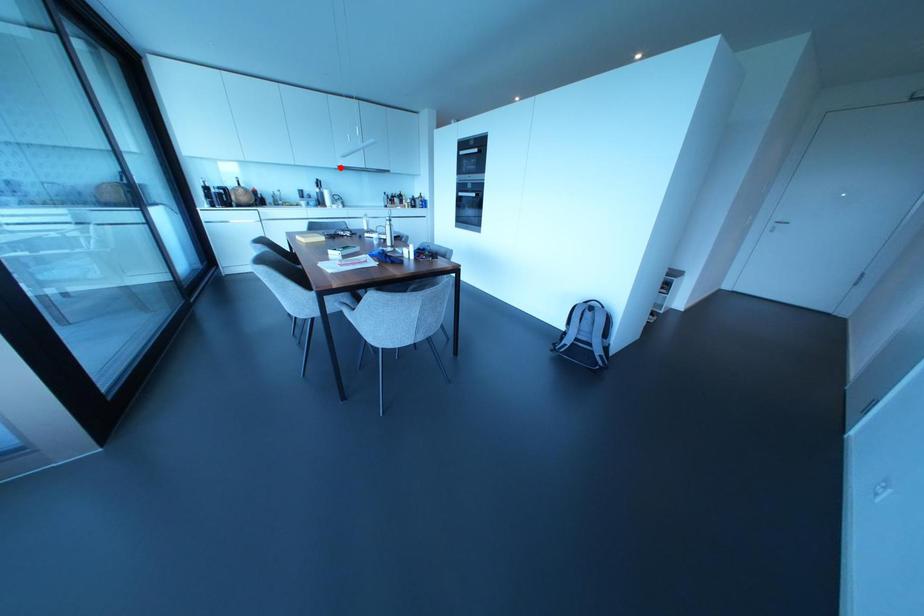
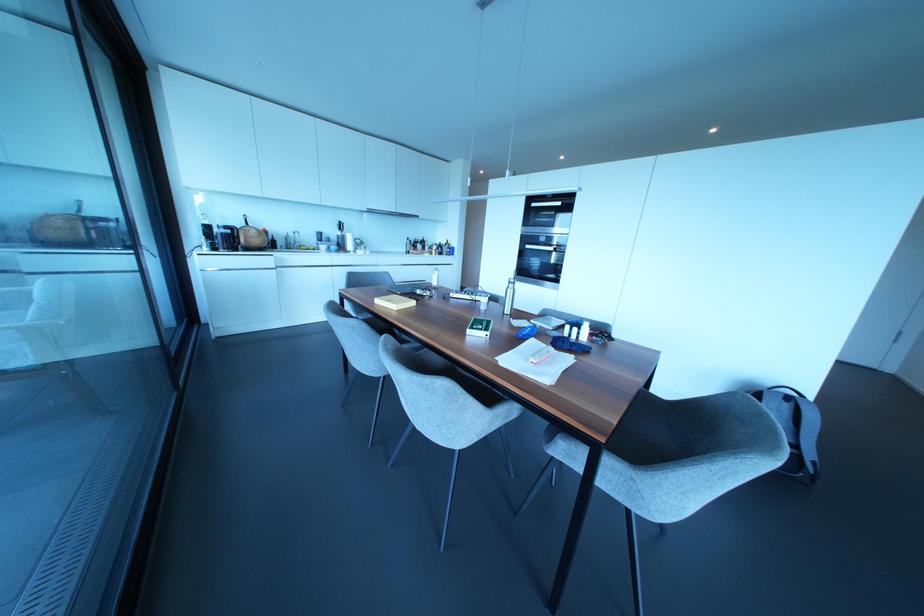
Question: I am providing you with two images of the same scene from different viewpoints. Given a red point in image1, look at the same physical point in image2. Is it:

Choices:
 (A) Closer to the viewpoint
 (B) Farther from the viewpoint

Answer: (B)